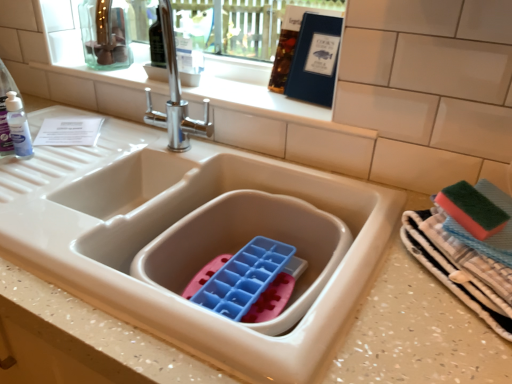
Question: Is textured cotton towels at right at the back of satin nickel faucet at upper center?

Choices:
 (A) no
 (B) yes

Answer: (A)

Question: Considering the relative sizes of satin nickel faucet at upper center and textured cotton towels at right in the image provided, is satin nickel faucet at upper center shorter than textured cotton towels at right?

Choices:
 (A) no
 (B) yes

Answer: (A)

Question: From a real-world perspective, is satin nickel faucet at upper center physically below textured cotton towels at right?

Choices:
 (A) yes
 (B) no

Answer: (B)

Question: From the image's perspective, is satin nickel faucet at upper center below textured cotton towels at right?

Choices:
 (A) no
 (B) yes

Answer: (A)

Question: Is satin nickel faucet at upper center to the right of textured cotton towels at right from the viewer's perspective?

Choices:
 (A) yes
 (B) no

Answer: (B)

Question: Considering the relative sizes of satin nickel faucet at upper center and textured cotton towels at right in the image provided, is satin nickel faucet at upper center smaller than textured cotton towels at right?

Choices:
 (A) no
 (B) yes

Answer: (B)

Question: Is textured cotton towels at right positioned behind satin nickel faucet at upper center?

Choices:
 (A) yes
 (B) no

Answer: (B)

Question: Considering the relative positions of textured cotton towels at right and satin nickel faucet at upper center in the image provided, is textured cotton towels at right to the right of satin nickel faucet at upper center from the viewer's perspective?

Choices:
 (A) no
 (B) yes

Answer: (B)

Question: Is textured cotton towels at right at the left side of satin nickel faucet at upper center?

Choices:
 (A) no
 (B) yes

Answer: (A)

Question: Is textured cotton towels at right positioned far away from satin nickel faucet at upper center?

Choices:
 (A) yes
 (B) no

Answer: (B)

Question: Is textured cotton towels at right beside satin nickel faucet at upper center?

Choices:
 (A) yes
 (B) no

Answer: (B)

Question: From a real-world perspective, is textured cotton towels at right positioned under satin nickel faucet at upper center based on gravity?

Choices:
 (A) no
 (B) yes

Answer: (B)

Question: Visually, is textured cotton towels at right positioned to the left or to the right of satin nickel faucet at upper center?

Choices:
 (A) left
 (B) right

Answer: (B)